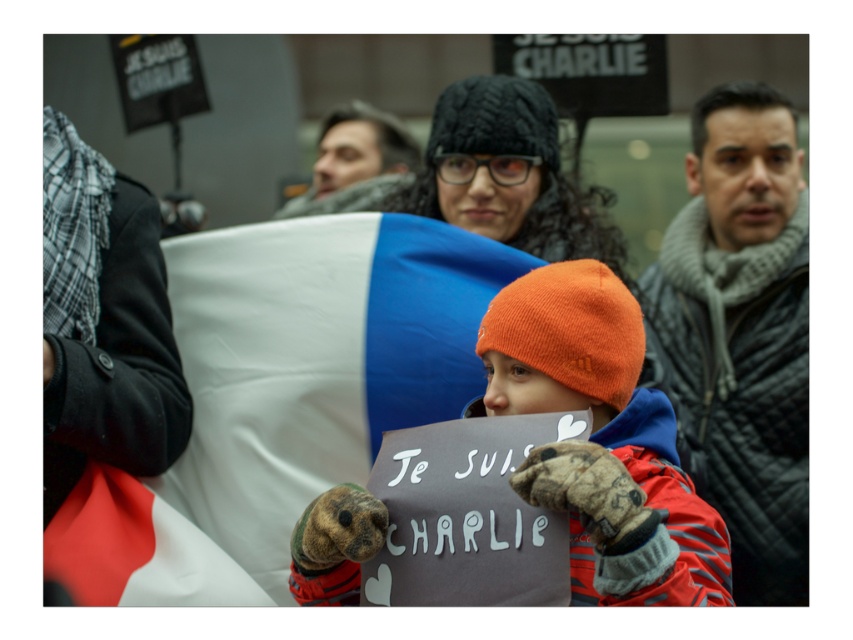
Question: Which point appears closest to the camera in this image?

Choices:
 (A) (610, 424)
 (B) (299, 275)

Answer: (A)

Question: Which point is farther to the camera?

Choices:
 (A) (294, 420)
 (B) (563, 381)

Answer: (A)

Question: In this image, where is white fabric flag at center located relative to gray quilted jacket at right?

Choices:
 (A) above
 (B) below

Answer: (B)

Question: Does white fabric flag at center have a greater width compared to gray quilted jacket at right?

Choices:
 (A) yes
 (B) no

Answer: (A)

Question: Which point is farther to the camera?

Choices:
 (A) (756, 109)
 (B) (213, 292)

Answer: (A)

Question: Is white fabric flag at center smaller than gray quilted jacket at right?

Choices:
 (A) no
 (B) yes

Answer: (B)